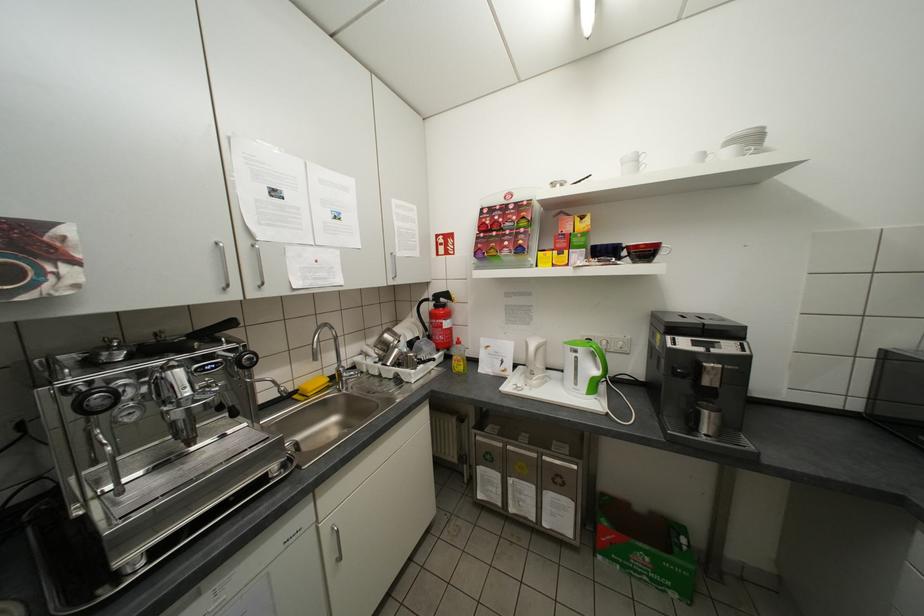
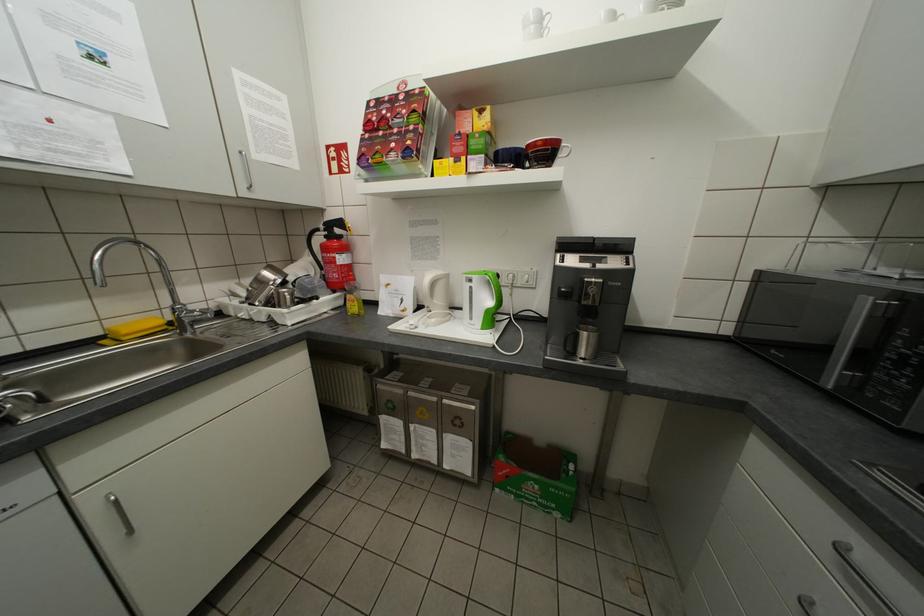
The point at (712, 156) is marked in the first image. Where is the corresponding point in the second image?

(623, 17)